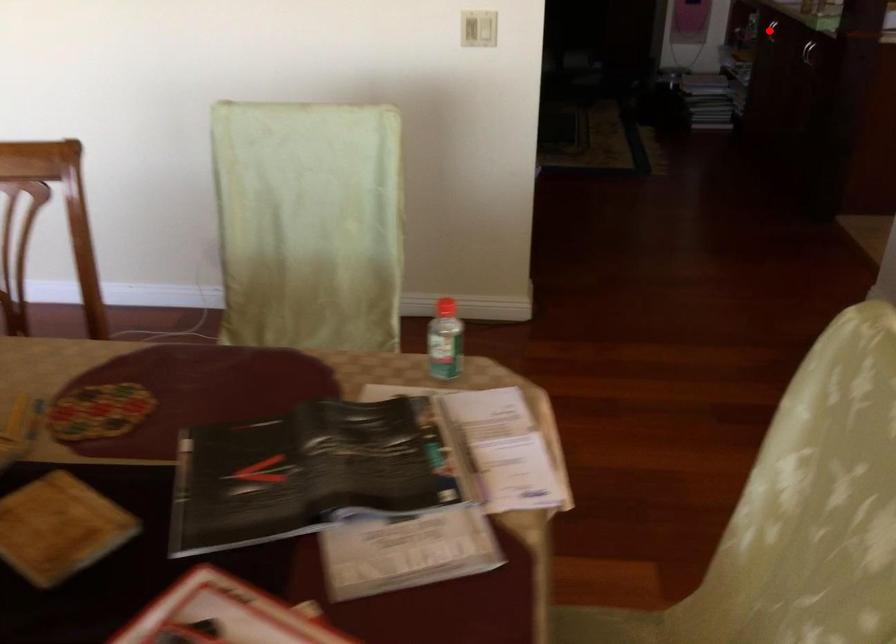
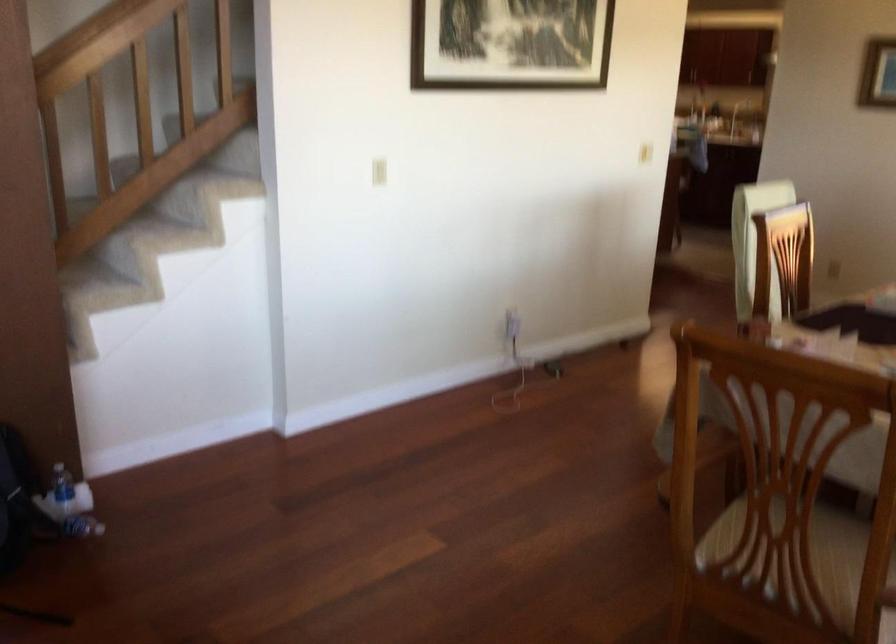
Question: I am providing you with two images of the same scene from different viewpoints. A red point is marked on the first image. At the location where the point appears in image 1, is it still visible in image 2?

Choices:
 (A) Yes
 (B) No

Answer: (B)